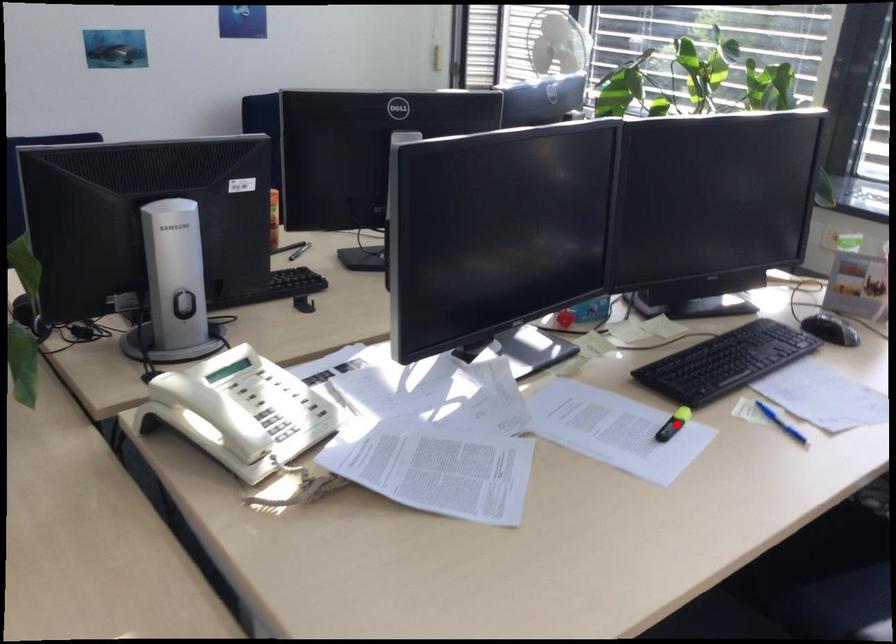
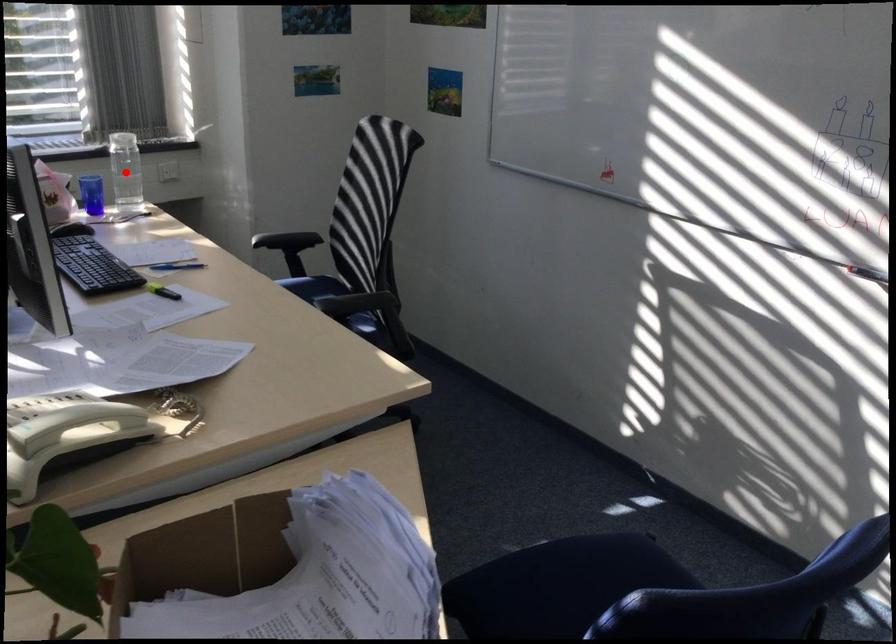
I am providing you with two images of the same scene from different viewpoints. A red point is marked on the first image and another point is marked on the second image. Does the point marked in image1 correspond to the same location as the one in image2?

No